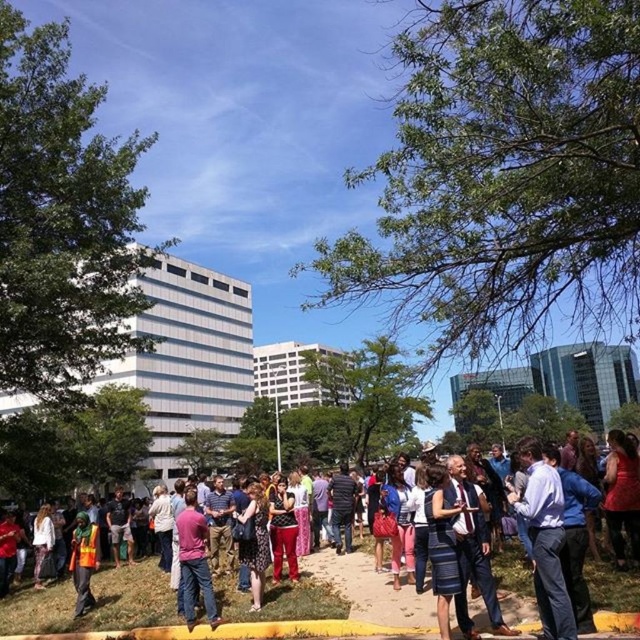
Measure the distance from blue denim jeans at center to pink fabric shirt at center.

blue denim jeans at center and pink fabric shirt at center are 1.38 meters apart from each other.

Between blue denim jeans at center and pink fabric shirt at center, which one appears on the right side from the viewer's perspective?

blue denim jeans at center

Which is behind, point (428, 609) or point (180, 550)?

Positioned behind is point (180, 550).

Where is `blue denim jeans at center`? The image size is (640, 640). blue denim jeans at center is located at coordinates (230, 605).

Is blue denim jeans at center taller than reflective orange vest at lower left?

Yes, blue denim jeans at center is taller than reflective orange vest at lower left.

The image size is (640, 640). Describe the element at coordinates (230, 605) in the screenshot. I see `blue denim jeans at center` at that location.

Image resolution: width=640 pixels, height=640 pixels. Identify the location of blue denim jeans at center. (230, 605).

Which is behind, point (212, 612) or point (76, 614)?

Point (76, 614)

Is point (182, 538) positioned before point (68, 557)?

Yes, it is.

I want to click on pink fabric shirt at center, so click(195, 561).